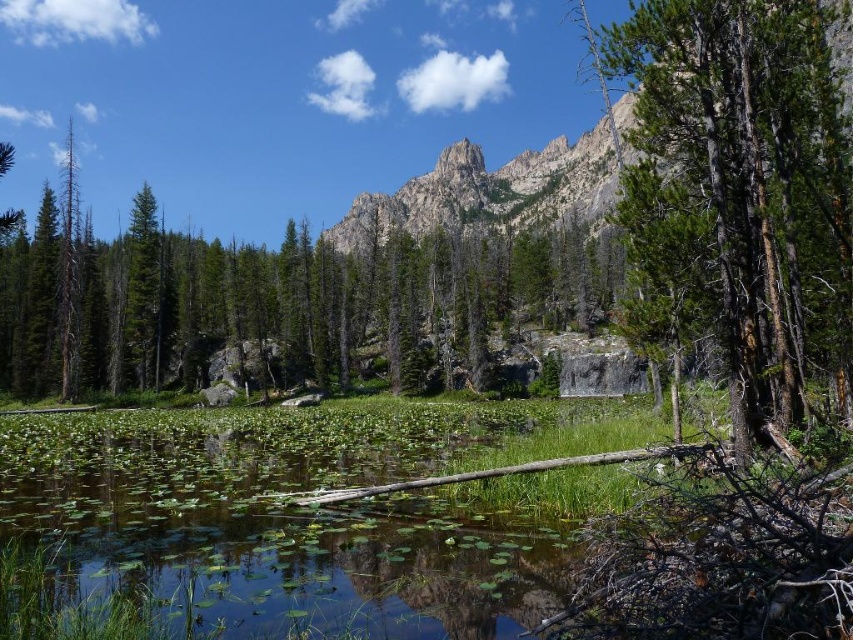
Does green rough bark tree at right have a smaller size compared to green leafy water at lower left?

Actually, green rough bark tree at right might be larger than green leafy water at lower left.

Is green rough bark tree at right closer to camera compared to green leafy water at lower left?

No.

Find the location of `green rough bark tree at right`. green rough bark tree at right is located at coordinates (741, 196).

Which is behind, point (511, 262) or point (85, 454)?

The point (511, 262) is behind.

The image size is (853, 640). In order to click on green textured rock at upper center in this screenshot , I will do `click(277, 301)`.

The image size is (853, 640). What are the coordinates of `green textured rock at upper center` in the screenshot? It's located at (277, 301).

Can you confirm if green rough bark tree at right is wider than green textured rock at upper center?

In fact, green rough bark tree at right might be narrower than green textured rock at upper center.

Measure the distance between green rough bark tree at right and camera.

green rough bark tree at right is 60.15 feet away from camera.

You are a GUI agent. You are given a task and a screenshot of the screen. Output one action in this format:
    pyautogui.click(x=<x>, y=<y>)
    Task: Click on the green rough bark tree at right
    
    Given the screenshot: What is the action you would take?
    pyautogui.click(x=741, y=196)